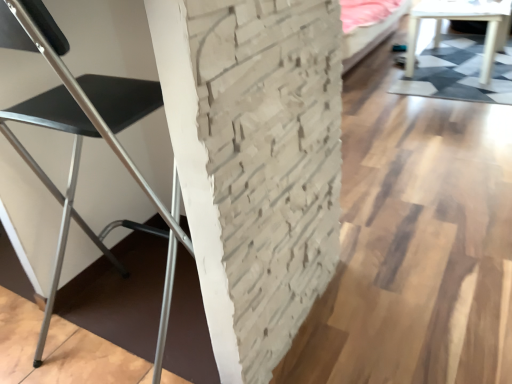
Question: Is black metal chair at left touching white glossy table at upper right?

Choices:
 (A) no
 (B) yes

Answer: (A)

Question: Is black metal chair at left behind white glossy table at upper right?

Choices:
 (A) no
 (B) yes

Answer: (A)

Question: Is black metal chair at left positioned far away from white glossy table at upper right?

Choices:
 (A) yes
 (B) no

Answer: (A)

Question: From a real-world perspective, is black metal chair at left on top of white glossy table at upper right?

Choices:
 (A) no
 (B) yes

Answer: (B)

Question: Is black metal chair at left at the right side of white glossy table at upper right?

Choices:
 (A) yes
 (B) no

Answer: (B)

Question: Considering the relative sizes of black metal chair at left and white glossy table at upper right in the image provided, is black metal chair at left shorter than white glossy table at upper right?

Choices:
 (A) no
 (B) yes

Answer: (A)

Question: Can you confirm if white glossy table at upper right is positioned to the left of black metal chair at left?

Choices:
 (A) no
 (B) yes

Answer: (A)

Question: From the image's perspective, does white glossy table at upper right appear lower than black metal chair at left?

Choices:
 (A) no
 (B) yes

Answer: (A)

Question: Does white glossy table at upper right appear on the right side of black metal chair at left?

Choices:
 (A) no
 (B) yes

Answer: (B)

Question: Is white glossy table at upper right outside black metal chair at left?

Choices:
 (A) no
 (B) yes

Answer: (B)

Question: Considering the relative sizes of white glossy table at upper right and black metal chair at left in the image provided, is white glossy table at upper right smaller than black metal chair at left?

Choices:
 (A) no
 (B) yes

Answer: (A)

Question: From the image's perspective, is white glossy table at upper right over black metal chair at left?

Choices:
 (A) no
 (B) yes

Answer: (B)

Question: Which is correct: black metal chair at left is inside white glossy table at upper right, or outside of it?

Choices:
 (A) outside
 (B) inside

Answer: (A)